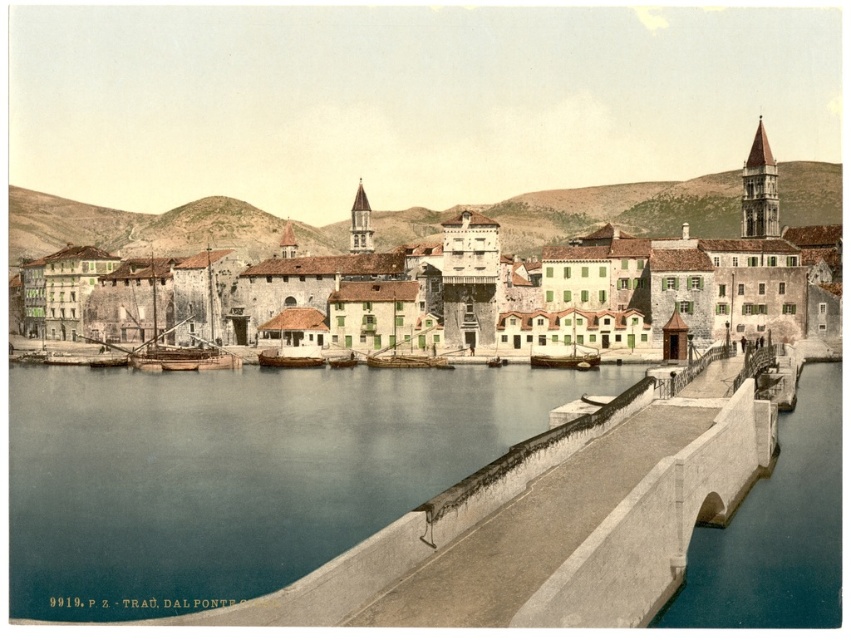
Question: Is blue water at lower left closer to camera compared to stone buildings at center?

Choices:
 (A) yes
 (B) no

Answer: (A)

Question: Among these points, which one is nearest to the camera?

Choices:
 (A) (827, 164)
 (B) (84, 456)

Answer: (B)

Question: Among these objects, which one is farthest from the camera?

Choices:
 (A) wooden boat at center
 (B) stone buildings at center
 (C) blue water at lower left

Answer: (B)

Question: Considering the relative positions of stone buildings at center and wooden boat at center in the image provided, where is stone buildings at center located with respect to wooden boat at center?

Choices:
 (A) right
 (B) left

Answer: (B)

Question: Which object appears closest to the camera in this image?

Choices:
 (A) blue water at lower left
 (B) wooden boat at center
 (C) stone buildings at center

Answer: (A)

Question: Is blue water at lower left thinner than stone buildings at center?

Choices:
 (A) no
 (B) yes

Answer: (B)